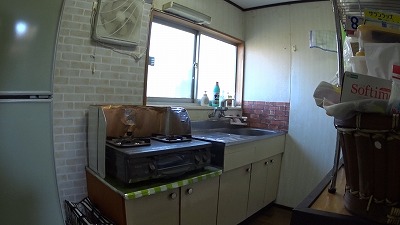
At what (x,y) coordinates should I click in order to perform the action: click on interior red brick wall. Please return your answer as a coordinate pair (x, y). Image resolution: width=400 pixels, height=225 pixels. Looking at the image, I should click on tap(271, 120).